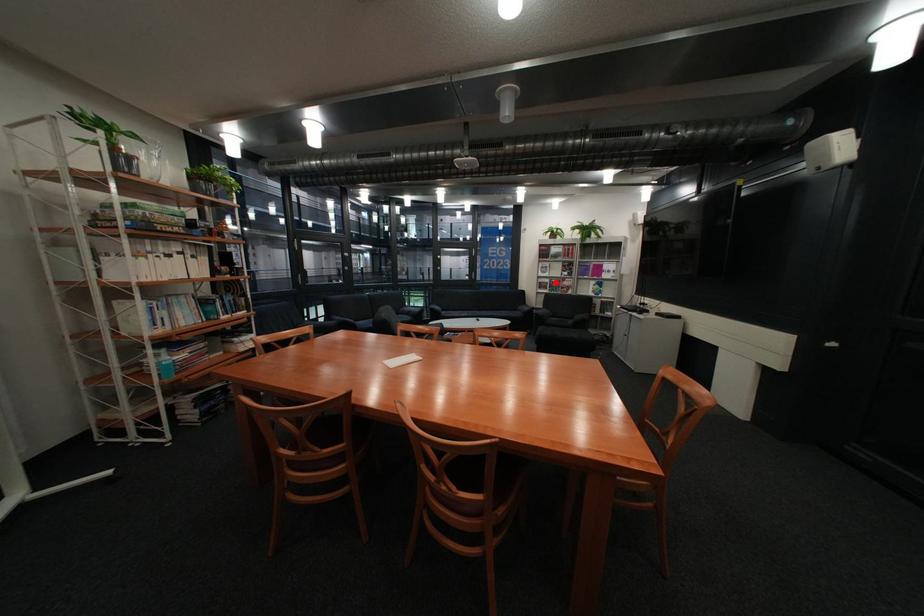
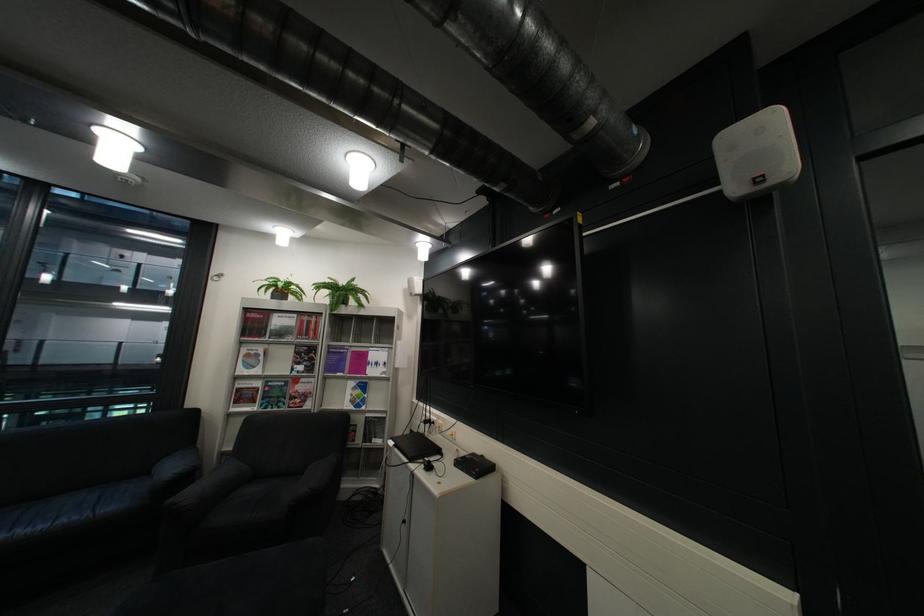
Question: I am providing you with two images of the same scene from different viewpoints. A red point is marked on the first image. Is the red point's position out of view in image 2?

Choices:
 (A) Yes
 (B) No

Answer: (B)